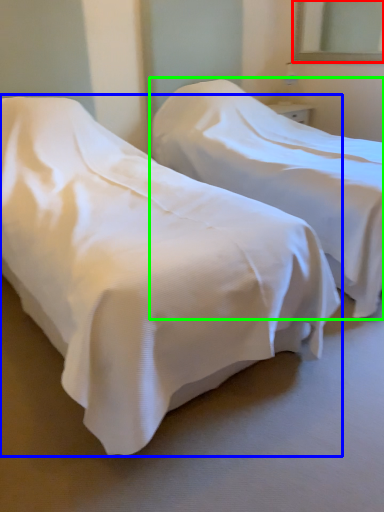
Question: Estimate the real-world distances between objects in this image. Which object is closer to mirror (highlighted by a red box), bed (highlighted by a blue box) or bed (highlighted by a green box)?

Choices:
 (A) bed
 (B) bed

Answer: (B)